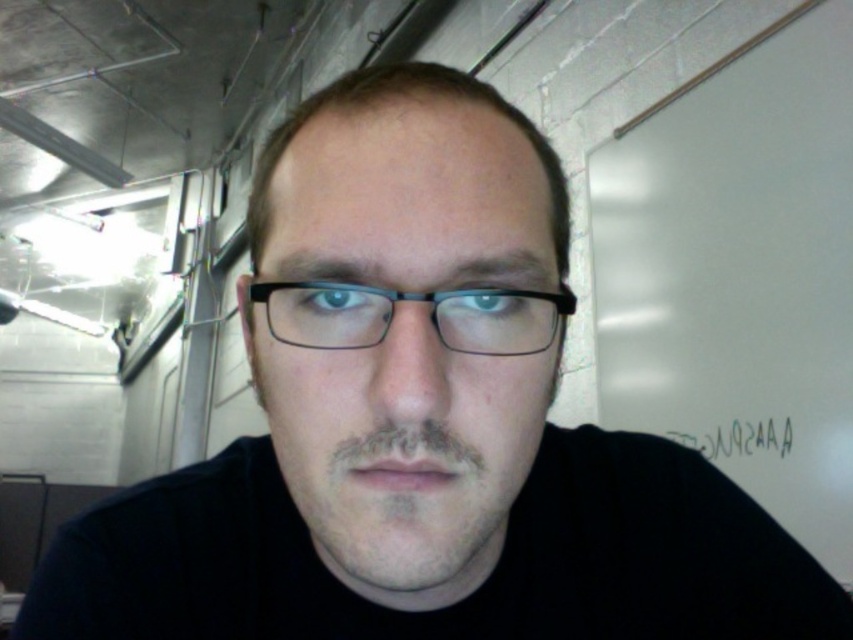
Measure the distance from black plastic glasses at center to black paper at lower right.

black plastic glasses at center is 1.12 meters from black paper at lower right.

Between black plastic glasses at center and black paper at lower right, which one is positioned higher?

black plastic glasses at center is higher up.

Does point (451, 308) lie behind point (721, 448)?

No, it is in front of (721, 448).

Image resolution: width=853 pixels, height=640 pixels. I want to click on black plastic glasses at center, so click(x=410, y=300).

Between dark brown stubble at center and black paper at lower right, which one is positioned lower?

Positioned lower is black paper at lower right.

You are a GUI agent. You are given a task and a screenshot of the screen. Output one action in this format:
    pyautogui.click(x=<x>, y=<y>)
    Task: Click on the dark brown stubble at center
    This screenshot has width=853, height=640.
    Given the screenshot: What is the action you would take?
    pyautogui.click(x=407, y=502)

Locate an element on the screen. The height and width of the screenshot is (640, 853). dark brown stubble at center is located at coordinates point(407,502).

Does point (346, 529) lie behind point (524, 312)?

No, (346, 529) is closer to viewer.

Who is more forward, (328,529) or (381,316)?

Point (381,316)

Find the location of a particular element. Image resolution: width=853 pixels, height=640 pixels. dark brown stubble at center is located at coordinates (407, 502).